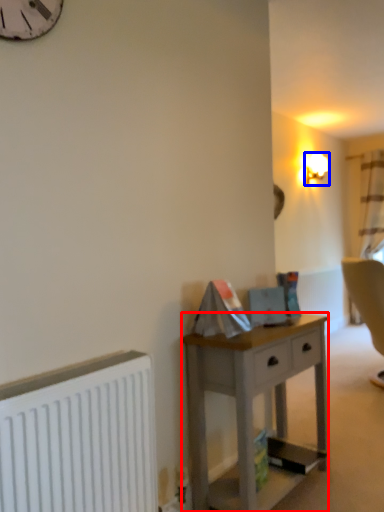
Question: Which object is further to the camera taking this photo, desk (highlighted by a red box) or lamp (highlighted by a blue box)?

Choices:
 (A) desk
 (B) lamp

Answer: (B)